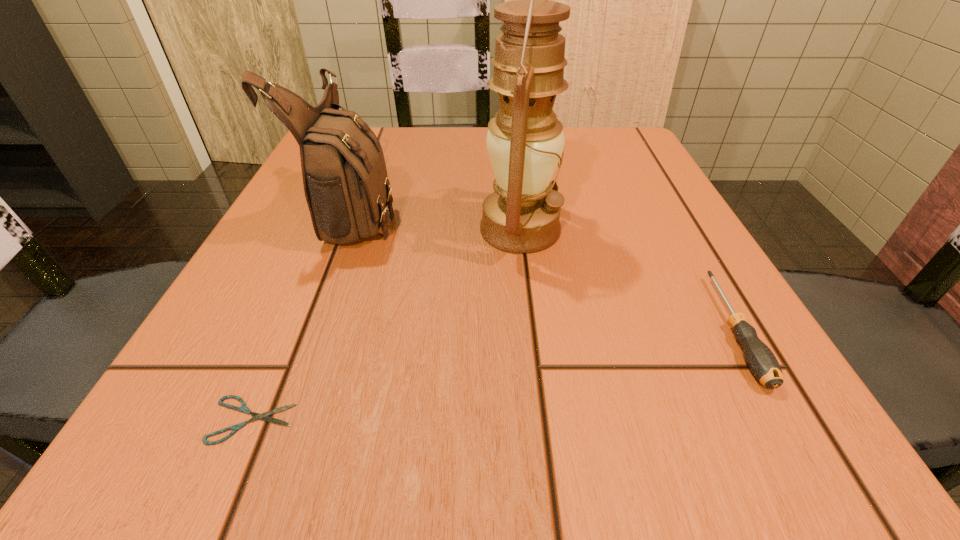
Identify the location of free point between the oil lamp and the second tallest object. This screenshot has height=540, width=960. (438, 221).

Where is `vacant space in between the second object from right to left and the shortest object`? This screenshot has width=960, height=540. vacant space in between the second object from right to left and the shortest object is located at coordinates [x=386, y=325].

This screenshot has height=540, width=960. What are the coordinates of `object that stands as the second closest to the shoulder bag` in the screenshot? It's located at (243, 408).

Identify the location of the third closest object relative to the shortest object. This screenshot has width=960, height=540. (761, 361).

Locate an element on the screen. vacant space that satisfies the following two spatial constraints: 1. on the back side of the tallest object; 2. on the right side of the shortest object is located at coordinates (332, 230).

Locate an element on the screen. This screenshot has width=960, height=540. free space that satisfies the following two spatial constraints: 1. on the front-facing side of the third object from left to right; 2. on the left side of the third shortest object is located at coordinates (348, 230).

At what (x,y) coordinates should I click in order to perform the action: click on free space that satisfies the following two spatial constraints: 1. on the back side of the tallest object; 2. on the right side of the nearest object. Please return your answer as a coordinate pair (x, y). The image size is (960, 540). Looking at the image, I should click on (332, 230).

Image resolution: width=960 pixels, height=540 pixels. What are the coordinates of `vacant area that satisfies the following two spatial constraints: 1. on the front-facing side of the third shortest object; 2. on the left side of the tallest object` in the screenshot? It's located at (348, 230).

Image resolution: width=960 pixels, height=540 pixels. Find the location of `free spot that satisfies the following two spatial constraints: 1. on the back side of the screwdriver; 2. on the front-facing side of the shoulder bag`. free spot that satisfies the following two spatial constraints: 1. on the back side of the screwdriver; 2. on the front-facing side of the shoulder bag is located at coordinates (668, 212).

Where is `free region that satisfies the following two spatial constraints: 1. on the front-facing side of the shoulder bag; 2. on the back side of the tallest object`? free region that satisfies the following two spatial constraints: 1. on the front-facing side of the shoulder bag; 2. on the back side of the tallest object is located at coordinates (348, 230).